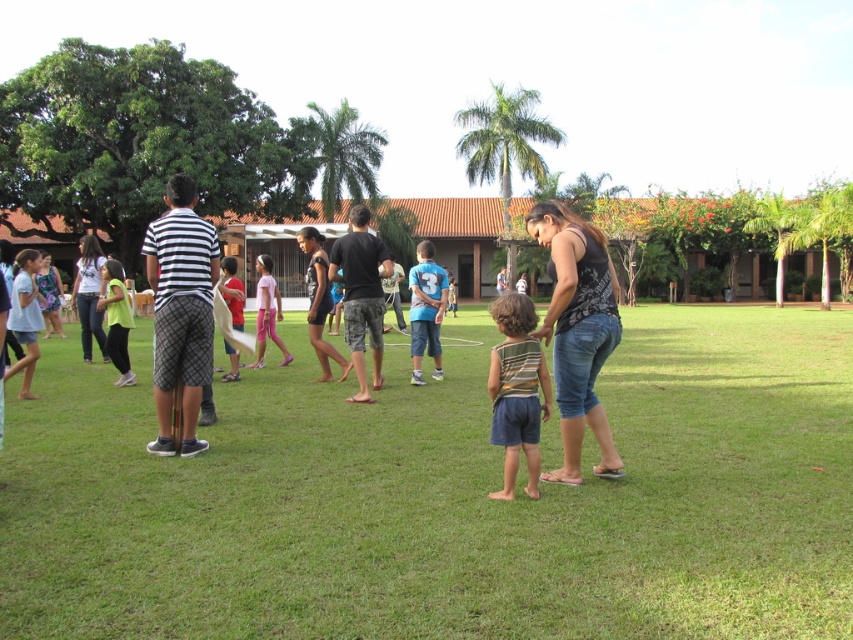
Question: Is light green jersey at center positioned in front of matte red shirt at center?

Choices:
 (A) no
 (B) yes

Answer: (B)

Question: Which point is closer to the camera?

Choices:
 (A) blue cotton shirt at center
 (B) pink fabric shorts at center
 (C) striped fabric shirt at center
 (D) matte red shirt at center

Answer: (C)

Question: Which point is closer to the camera?

Choices:
 (A) (80, 257)
 (B) (259, 326)

Answer: (B)

Question: Which of these objects is positioned farthest from the striped cotton shirt at center?

Choices:
 (A) blue cotton shirt at center
 (B) green grass at center
 (C) striped fabric shirt at center

Answer: (A)

Question: Is white matte shirt at center positioned in front of pink fabric shorts at center?

Choices:
 (A) no
 (B) yes

Answer: (B)

Question: Does striped fabric shirt at center appear on the right side of matte red shirt at center?

Choices:
 (A) no
 (B) yes

Answer: (B)